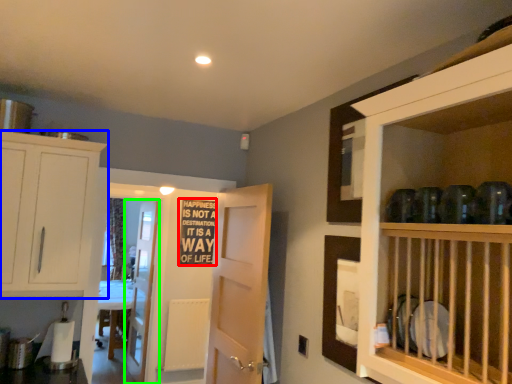
Question: Which is nearer to the writing (highlighted by a red box)? cabinetry (highlighted by a blue box) or door (highlighted by a green box).

Choices:
 (A) cabinetry
 (B) door

Answer: (B)